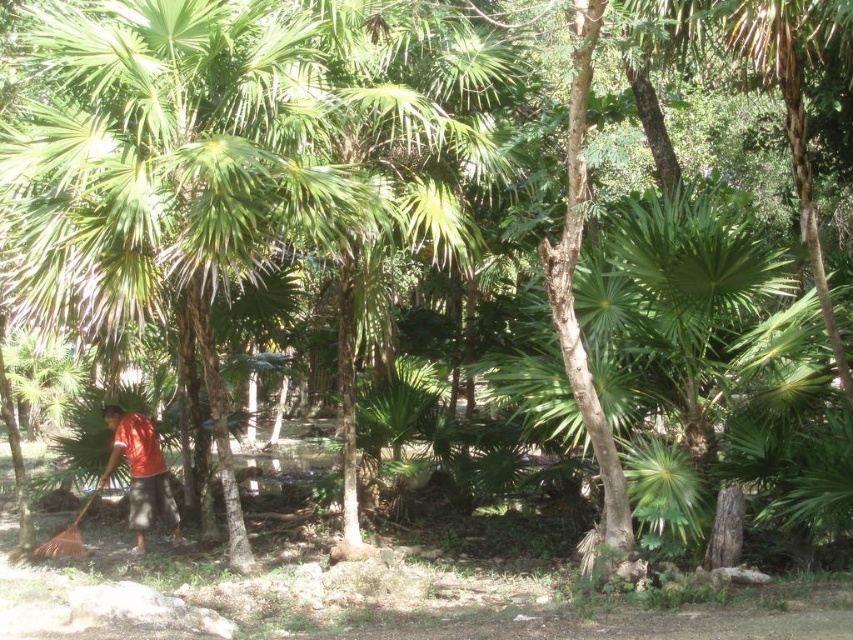
Question: Which object is closer to the camera taking this photo?

Choices:
 (A) orange fabric shirt at lower left
 (B) brown wooden shovel at lower left

Answer: (B)

Question: Which of the following is the closest to the observer?

Choices:
 (A) (155, 461)
 (B) (102, 486)

Answer: (A)

Question: Can you confirm if orange fabric shirt at lower left is positioned above brown wooden shovel at lower left?

Choices:
 (A) no
 (B) yes

Answer: (B)

Question: Observing the image, what is the correct spatial positioning of orange fabric shirt at lower left in reference to brown wooden shovel at lower left?

Choices:
 (A) below
 (B) above

Answer: (B)

Question: Is orange fabric shirt at lower left further to camera compared to brown wooden shovel at lower left?

Choices:
 (A) no
 (B) yes

Answer: (B)

Question: Which point is farther to the camera?

Choices:
 (A) orange fabric shirt at lower left
 (B) brown wooden shovel at lower left

Answer: (A)